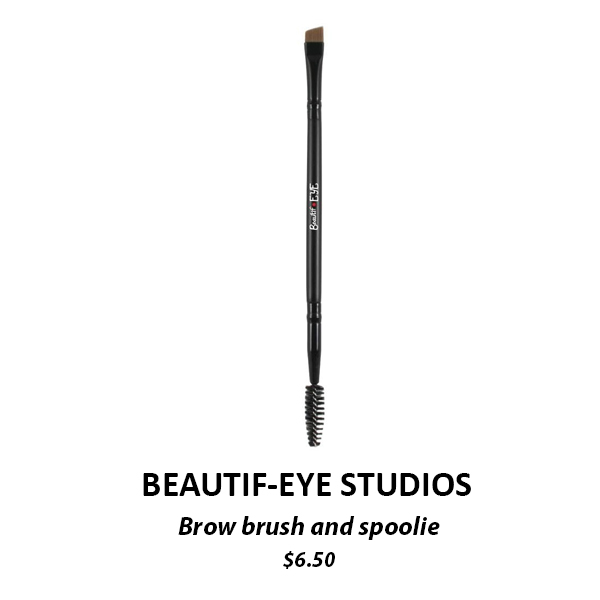
Where is `black handle`? This screenshot has width=600, height=600. black handle is located at coordinates (308, 322).